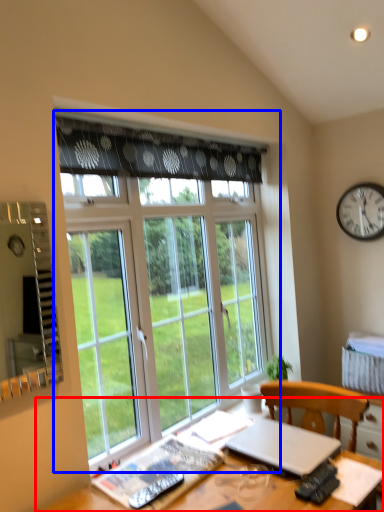
Question: Which object appears farthest to the camera in this image, desk (highlighted by a red box) or window (highlighted by a blue box)?

Choices:
 (A) desk
 (B) window

Answer: (B)